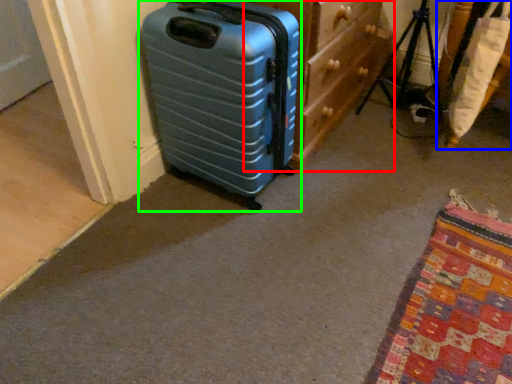
Question: Based on their relative distances, which object is farther from dresser (highlighted by a red box)? Choose from furniture (highlighted by a blue box) and suitcase (highlighted by a green box).

Choices:
 (A) furniture
 (B) suitcase

Answer: (A)